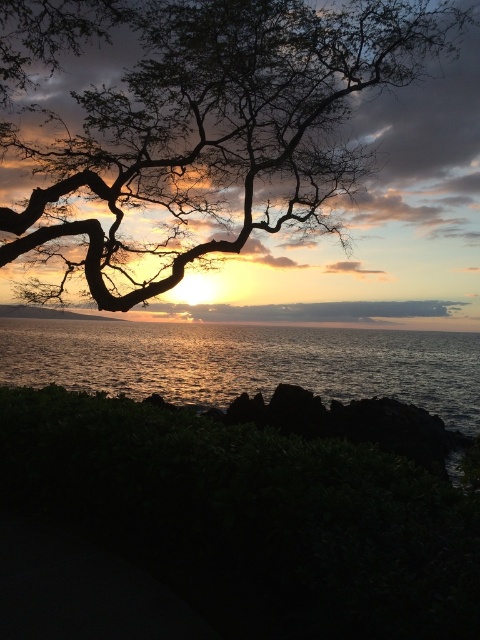
You are standing at the base of the dark brown bark tree at upper center. You want to place a 2.5 meter long bench in the garden so that it is exactly halfway between the tree and the dense cluster of dark green foliage in the foreground. Is this possible?

The distance between the dark brown bark tree at upper center and the dense cluster of dark green foliage in the foreground is 7.76 meters. Half of that distance is 3.88 meters. Since the bench is 2.5 meters long, placing it halfway would require at least 2.5 meters of space. Since 3.88 meters is greater than 2.5 meters, yes, it is possible to place the bench exactly halfway between them.

You are standing at the edge of the sea, looking at the sunset scene. There is a point marked at coordinates (205, 140). What object is located at that point?

The point at coordinates (205, 140) indicates the location of the dark brown bark tree at upper center.

You are standing in the sunset scene and want to take a photo of both the dark brown bark tree at upper center and the glistening silver water at center. Which object should you focus on first to ensure both are in sharp focus?

You should focus on the dark brown bark tree at upper center first because it is closer to you than the glistening silver water at center. By focusing on the closer object, the background object may still be acceptably sharp depending on the depth of field.